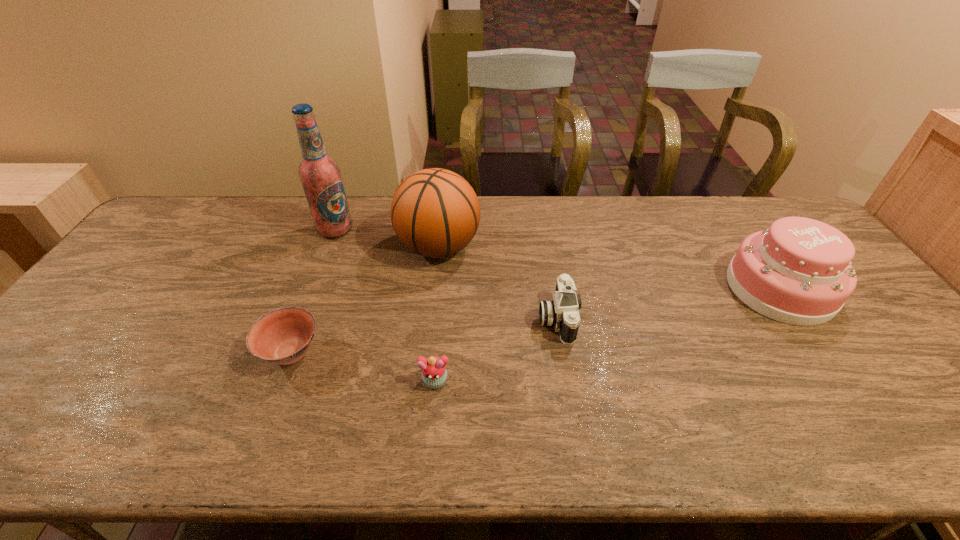
You are a GUI agent. You are given a task and a screenshot of the screen. Output one action in this format:
    pyautogui.click(x=<x>, y=<y>)
    Task: Click on the vacant space located 0.210m on the back of the rightmost object
    This screenshot has height=540, width=960.
    Given the screenshot: What is the action you would take?
    pyautogui.click(x=730, y=215)

Find the location of a particular element. This screenshot has height=540, width=960. vacant space positioned 0.330m on the right of the fourth tallest object is located at coordinates (698, 318).

Where is `free location located on the face of the cupcake`? free location located on the face of the cupcake is located at coordinates (428, 456).

This screenshot has height=540, width=960. I want to click on vacant space situated on the left of the bowl, so click(134, 353).

I want to click on alcohol that is at the far edge, so click(320, 175).

Locate an element on the screen. basketball at the far edge is located at coordinates (435, 213).

Where is `object that is at the right edge`? The image size is (960, 540). object that is at the right edge is located at coordinates (798, 271).

This screenshot has width=960, height=540. Identify the location of vacant space at the far edge. (651, 219).

Identify the location of free space at the near edge of the desktop. This screenshot has height=540, width=960. (872, 426).

At what (x,y) coordinates should I click in order to perform the action: click on vacant space at the right edge. Please return your answer as a coordinate pair (x, y). The height and width of the screenshot is (540, 960). Looking at the image, I should click on (860, 293).